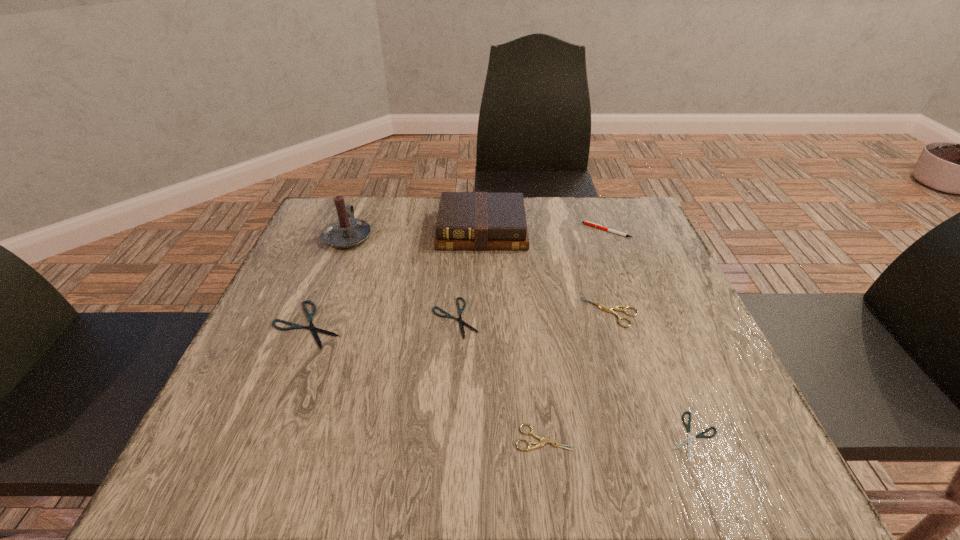
Where is `shears present at the left edge`? This screenshot has height=540, width=960. shears present at the left edge is located at coordinates (311, 327).

Find the location of `pen at the right edge`. pen at the right edge is located at coordinates (585, 222).

Image resolution: width=960 pixels, height=540 pixels. In order to click on object present at the far left corner in this screenshot , I will do `click(345, 232)`.

This screenshot has height=540, width=960. In order to click on object positioned at the far right corner in this screenshot , I will do `click(585, 222)`.

The image size is (960, 540). In order to click on object that is positioned at the near right corner in this screenshot , I will do `click(700, 435)`.

In order to click on vacant space at the far edge of the desktop in this screenshot , I will do `click(540, 228)`.

Where is `vacant region at the near edge of the desktop`? The image size is (960, 540). vacant region at the near edge of the desktop is located at coordinates (402, 459).

Identify the location of vacant position at the left edge of the desktop. This screenshot has height=540, width=960. (327, 290).

Where is `vacant space at the right edge of the desktop`? vacant space at the right edge of the desktop is located at coordinates (690, 309).

Identify the location of vacant region at the near left corner of the desktop. (245, 444).